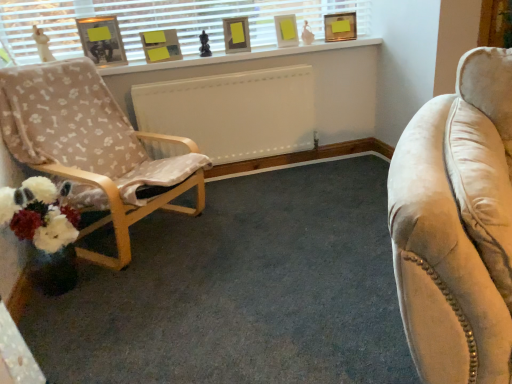
Question: From a real-world perspective, relative to matte white picture frame at upper center, arranged as the second picture frame when viewed from the right, is matte gold picture frame at upper center, acting as the 5th picture frame starting from the left, vertically above or below?

Choices:
 (A) above
 (B) below

Answer: (B)

Question: Visually, is matte gold picture frame at upper center, positioned as the first picture frame in right-to-left order, positioned to the left or to the right of matte white picture frame at upper center, marked as the 4th picture frame in a left-to-right arrangement?

Choices:
 (A) right
 (B) left

Answer: (A)

Question: Estimate the real-world distances between objects in this image. Which object is farther from the matte white picture frame at upper center, arranged as the second picture frame when viewed from the right?

Choices:
 (A) matte gold picture frame at upper center, positioned as the first picture frame in right-to-left order
 (B) wooden chair with bone-patterned fabric at left
 (C) matte cardboard picture frame at upper center, the 4th picture frame from the right
 (D) matte gray picture frame at upper center, acting as the 3th picture frame starting from the left
 (E) white painted wood at upper center

Answer: (B)

Question: Which object is the closest to the white matte window sill at upper center?

Choices:
 (A) white painted wood at upper center
 (B) matte gold picture frame at upper center, positioned as the first picture frame in right-to-left order
 (C) matte cardboard picture frame at upper center, the 4th picture frame from the right
 (D) wooden chair with bone-patterned fabric at left
 (E) matte gray picture frame at upper center, which is counted as the 3th picture frame, starting from the right

Answer: (A)